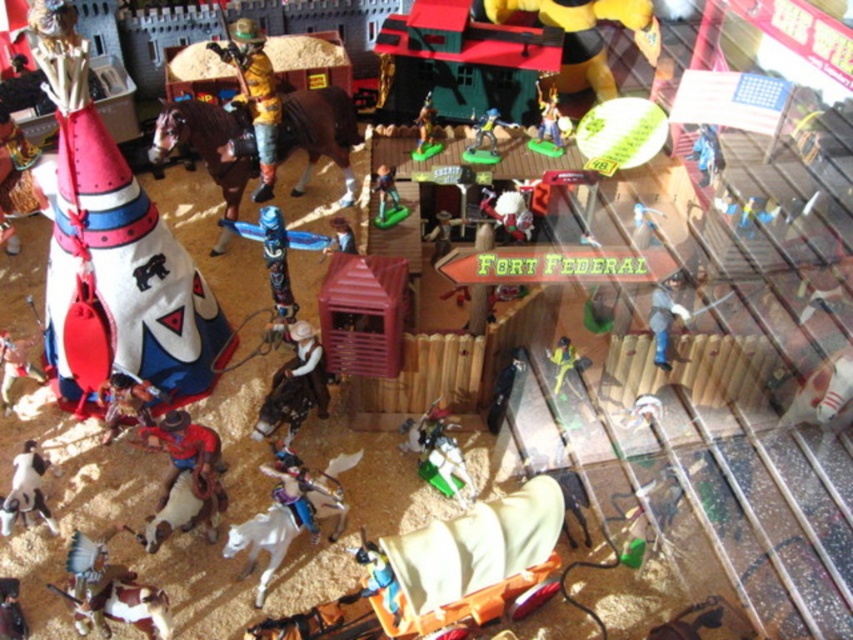
You are a visitor at the toy store and want to place a new toy horse between the wooden totem pole at center and the metallic silver cowboy at center. Based on their current positions, where should the toy horse be placed?

The wooden totem pole at center is positioned under the metallic silver cowboy at center, so the toy horse should be placed between them horizontally since the cowboy is above the totem pole.

You are a collector examining the Western diorama. You notice the brown matte horse at upper left and the green plastic toy at lower right. Which object is taller?

The brown matte horse at upper left is taller than the green plastic toy at lower right.

You are examining the Western diorama and notice two points marked in the scene. Which of the two points, point (289, 285) or point (490, 147), is nearer to your viewpoint?

Point (289, 285) is closer to the camera than point (490, 147), so it is nearer to your viewpoint.